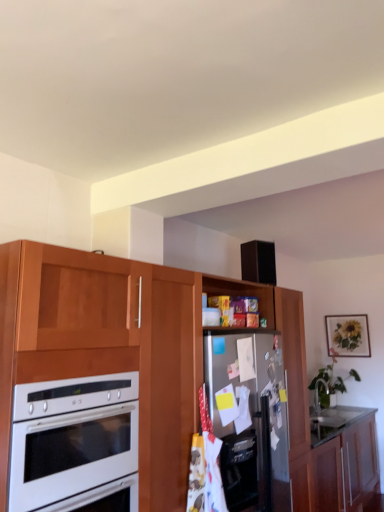
Question: Is white glossy oven at left smaller than matte wooden picture frame at upper right?

Choices:
 (A) no
 (B) yes

Answer: (A)

Question: From the image's perspective, is white glossy oven at left on matte wooden picture frame at upper right?

Choices:
 (A) yes
 (B) no

Answer: (A)

Question: From the image's perspective, does white glossy oven at left appear lower than matte wooden picture frame at upper right?

Choices:
 (A) yes
 (B) no

Answer: (B)

Question: From a real-world perspective, is white glossy oven at left on top of matte wooden picture frame at upper right?

Choices:
 (A) no
 (B) yes

Answer: (A)

Question: Is white glossy oven at left thinner than matte wooden picture frame at upper right?

Choices:
 (A) no
 (B) yes

Answer: (A)

Question: Is white glossy oven at left in front of matte wooden picture frame at upper right?

Choices:
 (A) yes
 (B) no

Answer: (A)

Question: Does wooden cabinet at center, which is the 1th cabinetry from top to bottom, have a larger size compared to white glossy oven at left?

Choices:
 (A) yes
 (B) no

Answer: (A)

Question: Is wooden cabinet at center, the 2th cabinetry ordered from the bottom, positioned beyond the bounds of white glossy oven at left?

Choices:
 (A) yes
 (B) no

Answer: (A)

Question: From a real-world perspective, is wooden cabinet at center, the 2th cabinetry ordered from the bottom, beneath white glossy oven at left?

Choices:
 (A) no
 (B) yes

Answer: (B)

Question: Can you confirm if wooden cabinet at center, the 2th cabinetry ordered from the bottom, is shorter than white glossy oven at left?

Choices:
 (A) yes
 (B) no

Answer: (B)

Question: Is wooden cabinet at center, which is the 1th cabinetry from top to bottom, next to white glossy oven at left and touching it?

Choices:
 (A) yes
 (B) no

Answer: (B)

Question: Would you say wooden cabinet at center, the 2th cabinetry ordered from the bottom, contains white glossy oven at left?

Choices:
 (A) yes
 (B) no

Answer: (A)

Question: Is white glossy oven at left smaller than wooden cabinet at lower right, which ranks as the first cabinetry in bottom-to-top order?

Choices:
 (A) no
 (B) yes

Answer: (B)